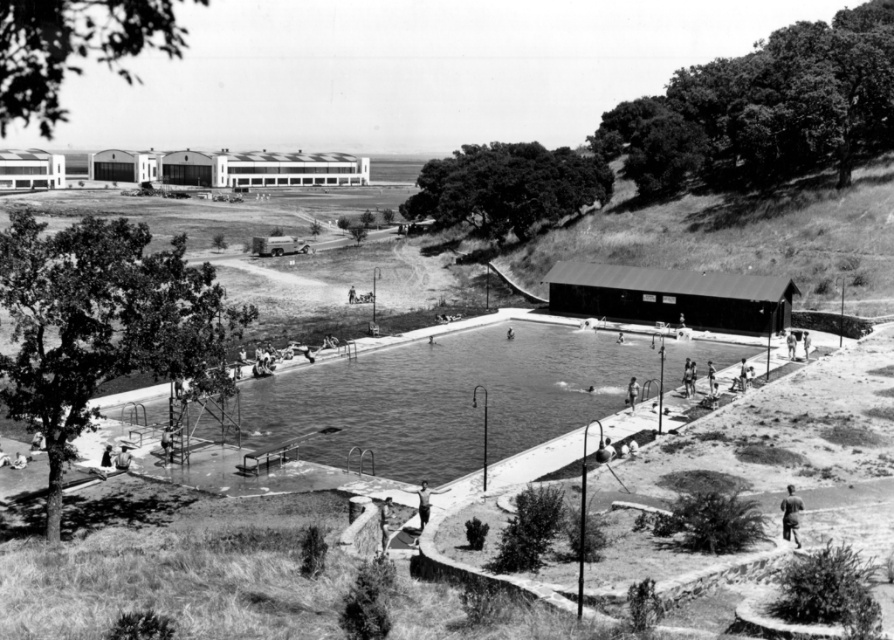
You are standing at the pool area and want to reach both the point at coordinates point [795,518] and point [419,516]. Which point should you reach first to minimize your walking distance?

You should reach point [795,518] first because it is closer to you than point [419,516].

You are a photographer standing at the edge of the pool. You want to take a photo of the smooth skin person at center without the dark brown leather jacket at lower right blocking the view. What should you do?

Move to the left side of the pool so that the dark brown leather jacket at lower right is no longer in front of the smooth skin person at center.

Consider the image. You are a lifeguard standing at the edge of the pool. You notice a dark brown leather jacket at lower right and a smooth skin person at center. If you want to retrieve the jacket without leaving your post, can you use a 75 feet long pole to reach it?

The dark brown leather jacket at lower right is 84.46 feet from the smooth skin person at center. Since the pole is only 75 feet long, it is not long enough to reach the jacket from the smooth skin person at center.